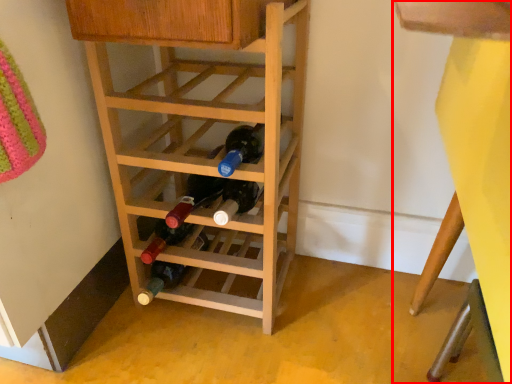
Question: Where is bunk bed (annotated by the red box) located in relation to shelf in the image?

Choices:
 (A) right
 (B) left

Answer: (A)